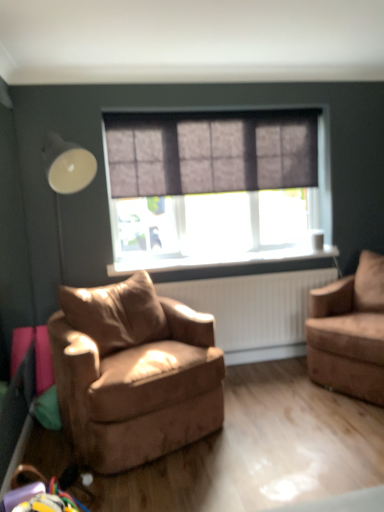
Question: From a real-world perspective, is black plastic window sill at center positioned under dark grey textured curtain at center based on gravity?

Choices:
 (A) no
 (B) yes

Answer: (B)

Question: Is the position of black plastic window sill at center less distant than that of dark grey textured curtain at center?

Choices:
 (A) no
 (B) yes

Answer: (A)

Question: Is black plastic window sill at center outside of dark grey textured curtain at center?

Choices:
 (A) yes
 (B) no

Answer: (A)

Question: Is black plastic window sill at center facing away from dark grey textured curtain at center?

Choices:
 (A) yes
 (B) no

Answer: (B)

Question: Does black plastic window sill at center have a greater height compared to dark grey textured curtain at center?

Choices:
 (A) no
 (B) yes

Answer: (A)

Question: From a real-world perspective, is black plastic window sill at center above or below dark grey textured curtain at center?

Choices:
 (A) below
 (B) above

Answer: (A)

Question: In terms of size, does black plastic window sill at center appear bigger or smaller than dark grey textured curtain at center?

Choices:
 (A) big
 (B) small

Answer: (B)

Question: From the image's perspective, relative to dark grey textured curtain at center, is black plastic window sill at center above or below?

Choices:
 (A) below
 (B) above

Answer: (A)

Question: Considering the positions of point (309, 252) and point (117, 129), is point (309, 252) closer or farther from the camera than point (117, 129)?

Choices:
 (A) closer
 (B) farther

Answer: (B)

Question: From a real-world perspective, is dark grey textured curtain at center above or below black plastic window sill at center?

Choices:
 (A) above
 (B) below

Answer: (A)

Question: From their relative heights in the image, would you say dark grey textured curtain at center is taller or shorter than black plastic window sill at center?

Choices:
 (A) tall
 (B) short

Answer: (A)

Question: Considering the positions of dark grey textured curtain at center and black plastic window sill at center in the image, is dark grey textured curtain at center wider or thinner than black plastic window sill at center?

Choices:
 (A) wide
 (B) thin

Answer: (B)

Question: Relative to black plastic window sill at center, is dark grey textured curtain at center in front or behind?

Choices:
 (A) behind
 (B) front

Answer: (B)

Question: Is black plastic window sill at center inside or outside of white glossy table lamp at left?

Choices:
 (A) outside
 (B) inside

Answer: (A)

Question: Relative to white glossy table lamp at left, is black plastic window sill at center in front or behind?

Choices:
 (A) front
 (B) behind

Answer: (B)